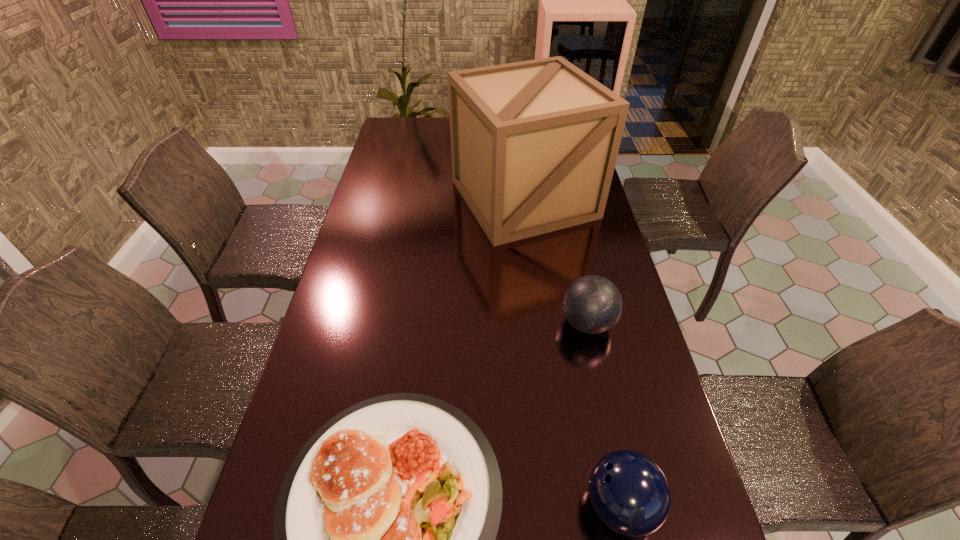
I want to click on vacant space at the left edge of the desktop, so 312,375.

Identify the location of vacant region at the right edge. The width and height of the screenshot is (960, 540). (594, 390).

Image resolution: width=960 pixels, height=540 pixels. I want to click on free space at the far left corner of the desktop, so click(406, 120).

Where is `vacant area between the box and the farther bowling ball`? vacant area between the box and the farther bowling ball is located at coordinates (556, 261).

I want to click on free space between the farther bowling ball and the tallest object, so click(x=556, y=261).

Image resolution: width=960 pixels, height=540 pixels. Identify the location of vacant area that lies between the second farthest object and the farthest object. (556, 261).

Locate which object is the second closest to the farther bowling ball. Please provide its 2D coordinates. Your answer should be formatted as a tuple, i.e. [(x, y)], where the tuple contains the x and y coordinates of a point satisfying the conditions above.

[(534, 144)]

Identify which object is located as the nearest to the second farthest object. Please provide its 2D coordinates. Your answer should be formatted as a tuple, i.e. [(x, y)], where the tuple contains the x and y coordinates of a point satisfying the conditions above.

[(384, 530)]